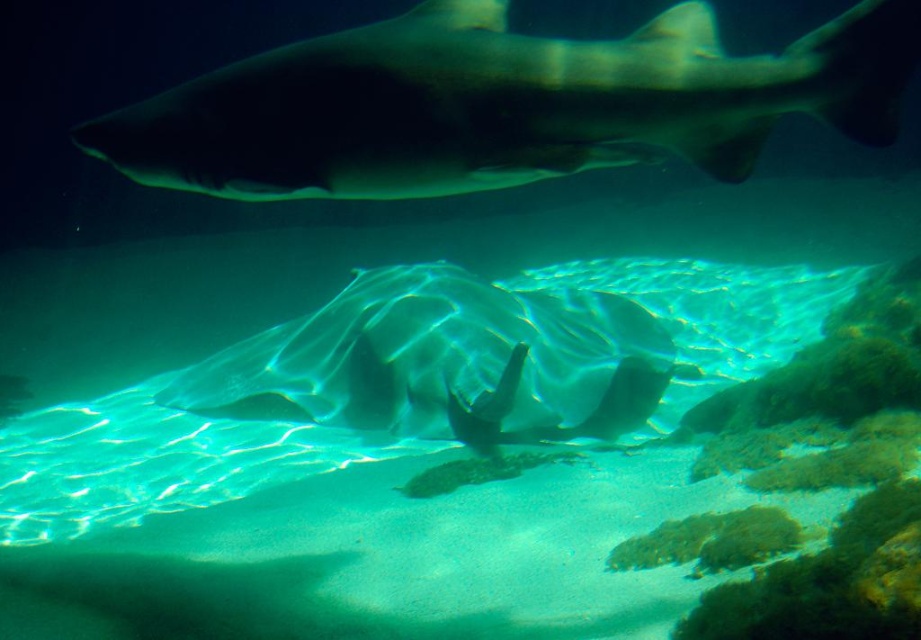
Question: Which object is farther from the camera taking this photo?

Choices:
 (A) smooth gray shark at upper center
 (B) translucent white shark at center

Answer: (B)

Question: Which of the following is the closest to the observer?

Choices:
 (A) (600, 296)
 (B) (499, 160)

Answer: (B)

Question: Which point is closer to the camera?

Choices:
 (A) (549, 369)
 (B) (529, 61)

Answer: (B)

Question: Is smooth gray shark at upper center positioned behind translucent white shark at center?

Choices:
 (A) yes
 (B) no

Answer: (B)

Question: Can you confirm if smooth gray shark at upper center is wider than translucent white shark at center?

Choices:
 (A) yes
 (B) no

Answer: (B)

Question: Is smooth gray shark at upper center closer to camera compared to translucent white shark at center?

Choices:
 (A) no
 (B) yes

Answer: (B)